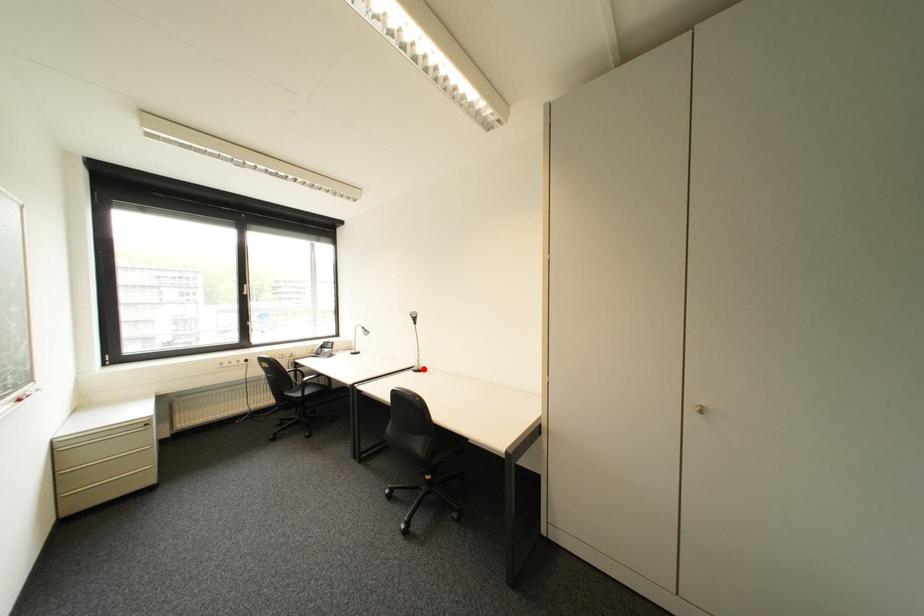
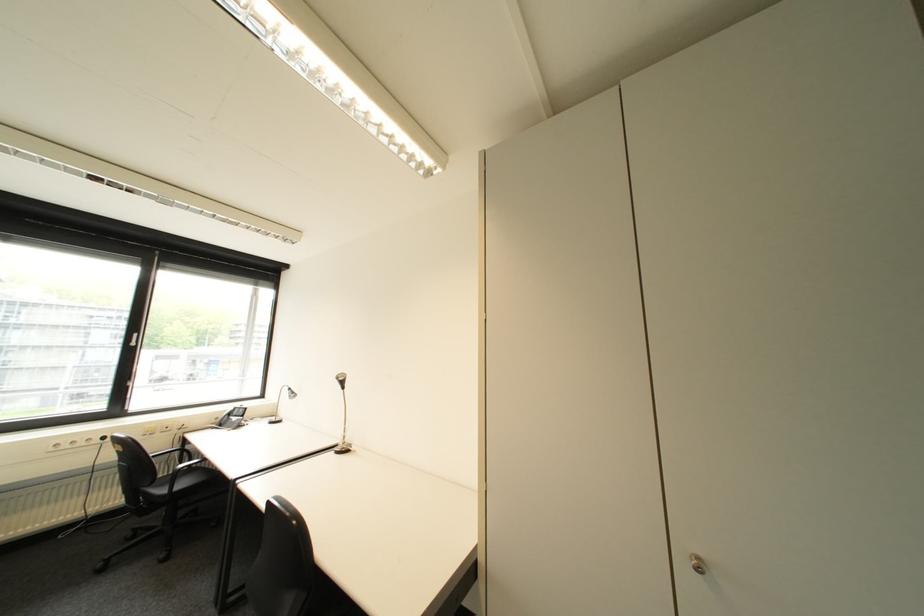
Where in the second image is the point corresponding to the highlighted location from the first image?

(346, 450)